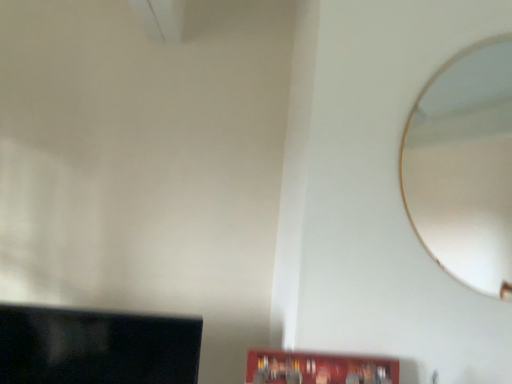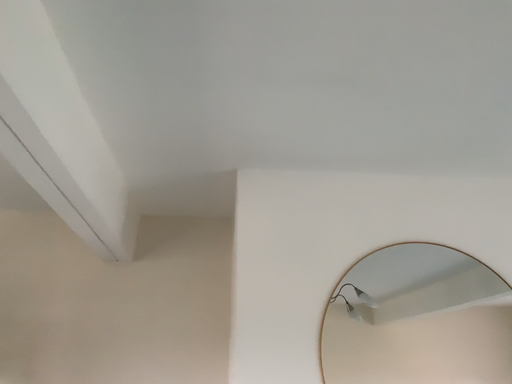
Question: Which way did the camera rotate in the video?

Choices:
 (A) rotated upward
 (B) rotated downward

Answer: (A)